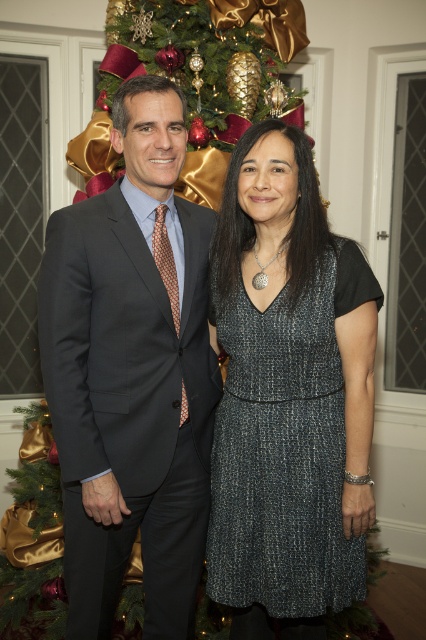
You are a photographer setting up for a group photo. The scene includes a dark gray suit at center and a sparkly metallic dress at center. You need to ensure there is at least 10 inches between them for proper framing. Based on the scene, will they need to adjust their positions?

The distance between the dark gray suit at center and the sparkly metallic dress at center is 9.32 inches, which is less than the required 10 inches. They need to move slightly apart to meet the framing requirement.

You are a photographer setting up for a group photo. You need to ensure that both the dark gray suit at center and the sparkly metallic dress at center can fit side by side within a 1.8 meter wide frame. Given their widths, will they both fit comfortably?

The dark gray suit at center is wider than the sparkly metallic dress at center. However, the combined width of both exceeds 1.8 meters, so they may not fit comfortably within the frame.

You are a photographer setting up for a group photo. You need to ensure that the dark gray suit at center and the sparkly metallic dress at center are both visible in the frame. Based on their heights, which one might require you to adjust the camera angle to ensure proper framing?

The dark gray suit at center has a greater height compared to the sparkly metallic dress at center, so you might need to adjust the camera angle to ensure the taller dark gray suit at center is fully captured without cropping the top of the frame.